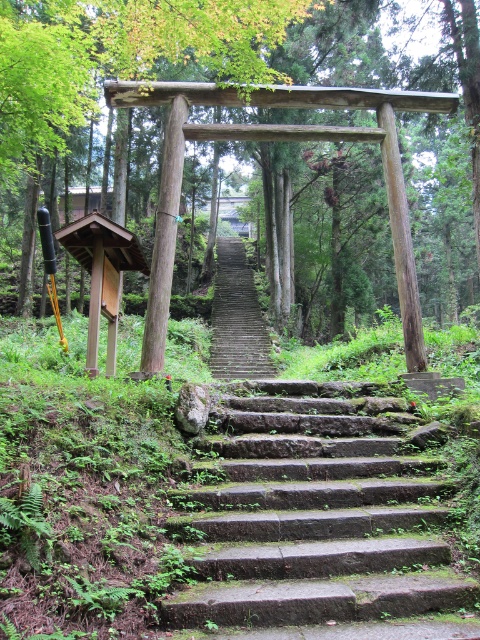
Looking at this image, you are standing at the base of the stone staircase leading to the shrine. You notice two points marked in the scene. Which point, point (421,616) or point (261,339), is closer to you as you face the staircase?

Point (421,616) is closer to the viewer than point (261,339).

You are a hiker with a backpack and want to climb the green mossy stone stairs at center. The steps are 2.69 meters apart. If your average step length is 0.75 meters, how many steps will you take to climb the entire staircase?

The green mossy stone stairs at center are 2.69 meters apart. With an average step length of 0.75 meters, you would need approximately 4 steps to climb the entire staircase since 2.69 divided by 0.75 equals approximately 3.58, which rounds up to 4 steps.

You are a photographer standing at the base of the stone staircase leading to the shrine. You want to capture a closeup shot of the green wood tree at center. Given that your camera has a maximum zoom range of 5 meters, will you be able to take the closeup without moving closer?

The green wood tree at center is 6.73 meters from the camera, which exceeds the camera maximum zoom range of 5 meters. Therefore, you cannot take the closeup without moving closer.